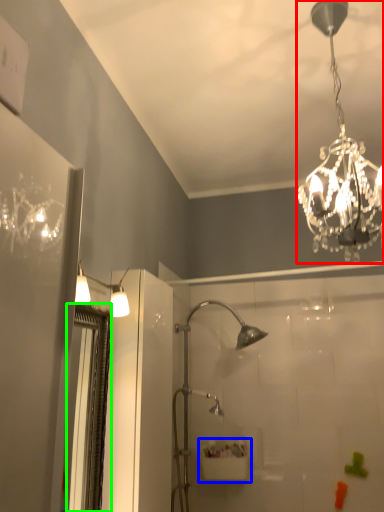
Question: Estimate the real-world distances between objects in this image. Which object is farther from lamp (highlighted by a red box), sink (highlighted by a blue box) or screen door (highlighted by a green box)?

Choices:
 (A) sink
 (B) screen door

Answer: (A)